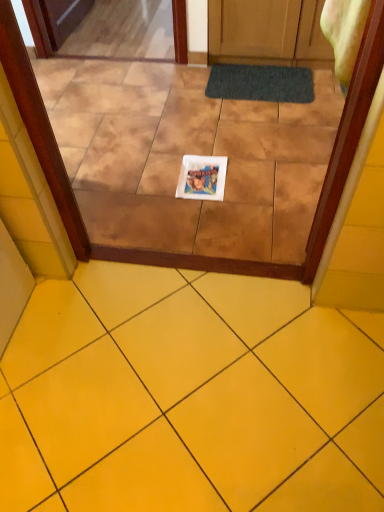
At what (x,y) coordinates should I click in order to perform the action: click on vacant space situated above white paper at center (from a real-world perspective). Please return your answer as a coordinate pair (x, y). Image resolution: width=384 pixels, height=512 pixels. Looking at the image, I should click on (201, 175).